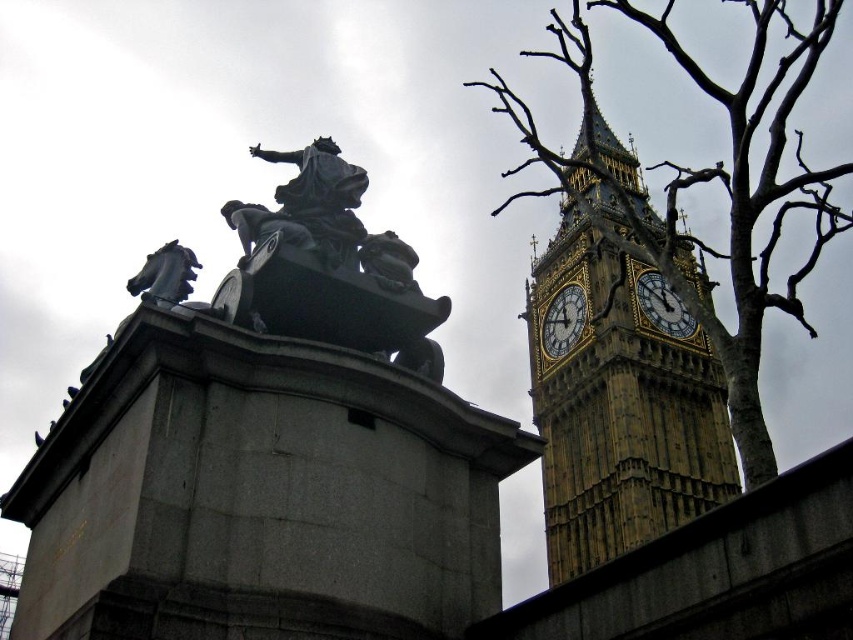
Question: Which point is closer to the camera?

Choices:
 (A) golden stone clock tower at upper right
 (B) black stone horse at left

Answer: (B)

Question: Is black stone horse at left above gold/yellow metal big ben at right?

Choices:
 (A) no
 (B) yes

Answer: (B)

Question: Based on their relative distances, which object is nearer to the bronze statue at center?

Choices:
 (A) gold/yellow metal big ben at right
 (B) gold textured clock at upper right
 (C) black stone horse at left
 (D) bare branches at upper right

Answer: (C)

Question: Can you confirm if golden stone clock tower at upper right is thinner than black stone horse at left?

Choices:
 (A) no
 (B) yes

Answer: (A)

Question: Which object is closer to the camera taking this photo?

Choices:
 (A) gold textured clock at upper right
 (B) gold/yellow metal big ben at right
 (C) golden stone clock tower at upper right

Answer: (C)

Question: Where is gold textured clock at upper right located in relation to gold/yellow metal big ben at right in the image?

Choices:
 (A) above
 (B) below

Answer: (B)